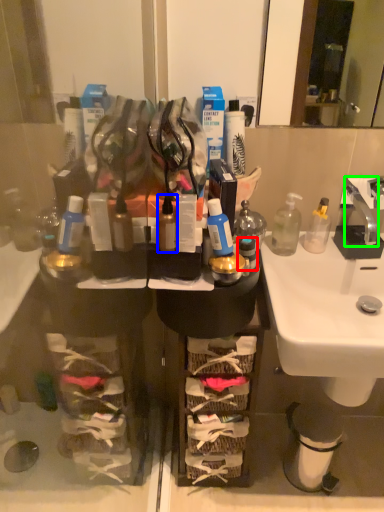
Question: Which object is positioned farthest from toiletry (highlighted by a red box)? Select from toiletry (highlighted by a blue box) and faucet (highlighted by a green box).

Choices:
 (A) toiletry
 (B) faucet

Answer: (B)